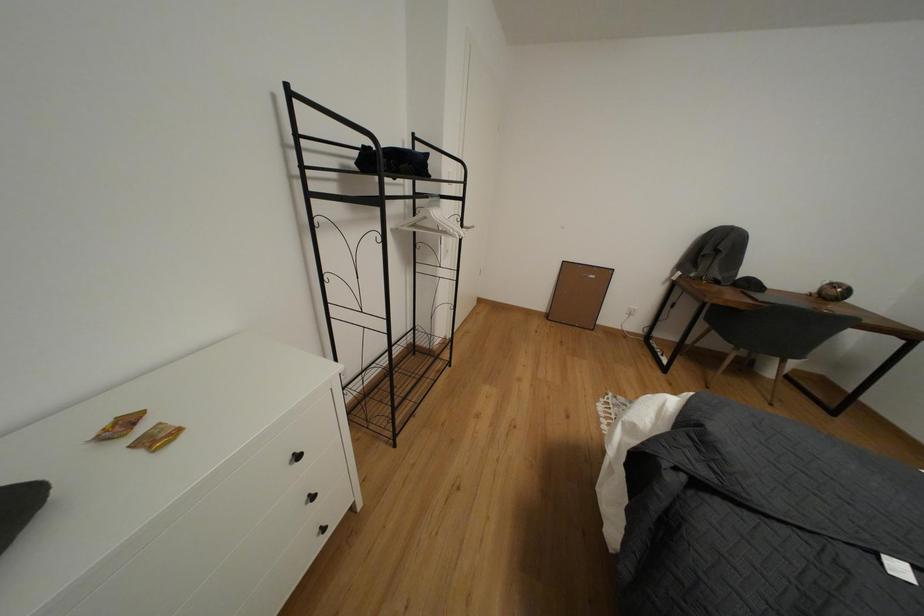
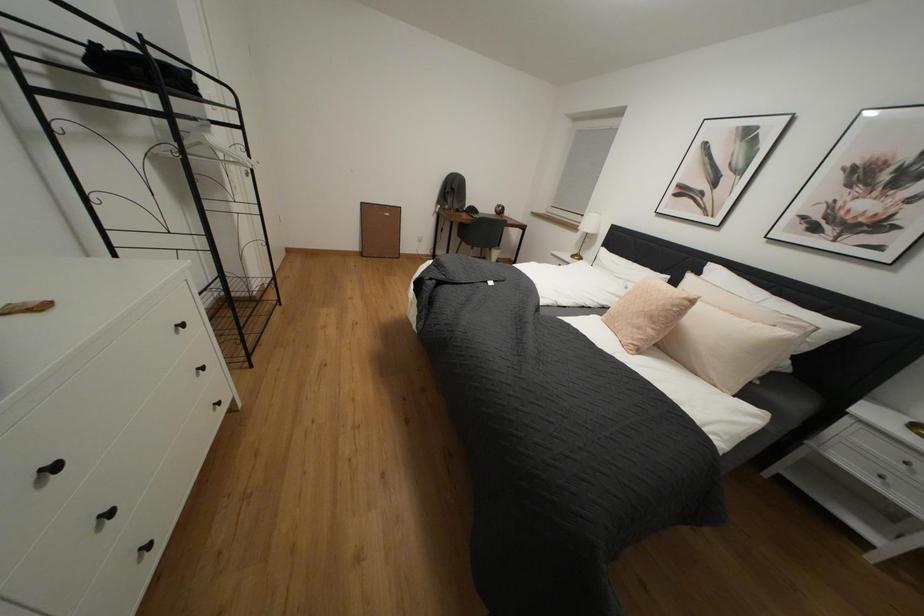
Question: Based on the continuous images, in which direction is the camera rotating? Reply with the corresponding letter.

Choices:
 (A) Left
 (B) Right
 (C) Up
 (D) Down

Answer: (B)